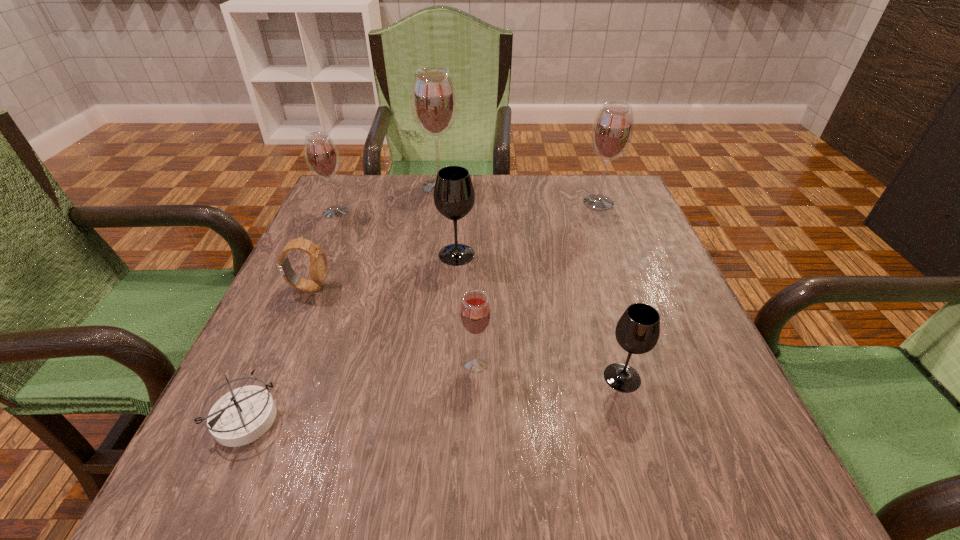
Image resolution: width=960 pixels, height=540 pixels. What are the coordinates of `vacant space at the far edge of the desktop` in the screenshot? It's located at (558, 209).

Where is `vacant space at the near edge of the desktop`? The height and width of the screenshot is (540, 960). vacant space at the near edge of the desktop is located at coordinates (516, 449).

The width and height of the screenshot is (960, 540). I want to click on free location at the left edge, so click(x=358, y=243).

Locate an element on the screen. vacant space at the right edge of the desktop is located at coordinates (582, 222).

I want to click on vacant area at the far left corner of the desktop, so click(355, 183).

At what (x,y) coordinates should I click in order to perform the action: click on free space at the far right corner of the desktop. Please return your answer as a coordinate pair (x, y). Looking at the image, I should click on (576, 202).

In the image, there is a desktop. At what (x,y) coordinates should I click in order to perform the action: click on vacant space at the near right corner. Please return your answer as a coordinate pair (x, y). Image resolution: width=960 pixels, height=540 pixels. Looking at the image, I should click on (688, 494).

Identify the location of free space between the left gray wineglass and the seventh shortest object. (528, 228).

I want to click on free space between the fourth farthest wineglass and the third smallest red wineglass, so click(x=528, y=228).

I want to click on free space between the second red wineglass from right to left and the leftmost red wineglass, so click(x=406, y=287).